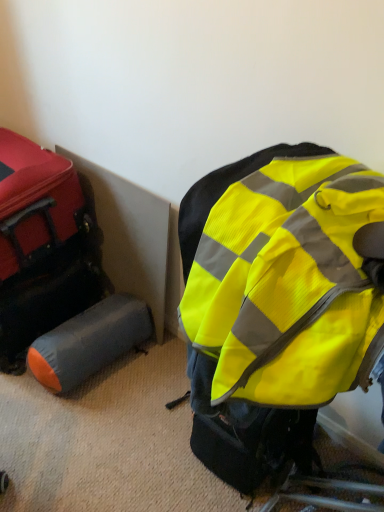
Question: From a real-world perspective, does matte red suitcase at left, marked as the first luggage in a top-to-bottom arrangement, sit lower than gray fabric cylinder at lower left, which is counted as the 1th luggage, starting from the bottom?

Choices:
 (A) yes
 (B) no

Answer: (B)

Question: Is matte red suitcase at left, placed as the second luggage when sorted from bottom to top, at the right side of gray fabric cylinder at lower left, which is counted as the 1th luggage, starting from the bottom?

Choices:
 (A) yes
 (B) no

Answer: (B)

Question: From a real-world perspective, is matte red suitcase at left, placed as the second luggage when sorted from bottom to top, located higher than gray fabric cylinder at lower left, which is counted as the 1th luggage, starting from the bottom?

Choices:
 (A) yes
 (B) no

Answer: (A)

Question: Is gray fabric cylinder at lower left, which is counted as the 1th luggage, starting from the bottom, surrounded by matte red suitcase at left, placed as the second luggage when sorted from bottom to top?

Choices:
 (A) yes
 (B) no

Answer: (B)

Question: Can you confirm if matte red suitcase at left, marked as the first luggage in a top-to-bottom arrangement, is bigger than gray fabric cylinder at lower left, the second luggage from the top?

Choices:
 (A) no
 (B) yes

Answer: (B)

Question: Does matte red suitcase at left, placed as the second luggage when sorted from bottom to top, turn towards gray fabric cylinder at lower left, which is counted as the 1th luggage, starting from the bottom?

Choices:
 (A) no
 (B) yes

Answer: (A)

Question: Considering the relative positions of matte red suitcase at left, marked as the first luggage in a top-to-bottom arrangement, and high-visibility fabric backpack at center in the image provided, is matte red suitcase at left, marked as the first luggage in a top-to-bottom arrangement, to the left of high-visibility fabric backpack at center from the viewer's perspective?

Choices:
 (A) yes
 (B) no

Answer: (A)

Question: Is matte red suitcase at left, placed as the second luggage when sorted from bottom to top, outside high-visibility fabric backpack at center?

Choices:
 (A) yes
 (B) no

Answer: (A)

Question: Can you confirm if matte red suitcase at left, placed as the second luggage when sorted from bottom to top, is wider than high-visibility fabric backpack at center?

Choices:
 (A) no
 (B) yes

Answer: (A)

Question: Is matte red suitcase at left, marked as the first luggage in a top-to-bottom arrangement, next to high-visibility fabric backpack at center?

Choices:
 (A) no
 (B) yes

Answer: (A)

Question: Considering the relative positions of matte red suitcase at left, placed as the second luggage when sorted from bottom to top, and high-visibility fabric backpack at center in the image provided, is matte red suitcase at left, placed as the second luggage when sorted from bottom to top, to the right of high-visibility fabric backpack at center from the viewer's perspective?

Choices:
 (A) yes
 (B) no

Answer: (B)

Question: Is there a large distance between matte red suitcase at left, placed as the second luggage when sorted from bottom to top, and high-visibility fabric backpack at center?

Choices:
 (A) no
 (B) yes

Answer: (A)

Question: Is orange-gray fabric sleeping bag at lower left outside of gray fabric cylinder at lower left, which is counted as the 1th luggage, starting from the bottom?

Choices:
 (A) yes
 (B) no

Answer: (A)